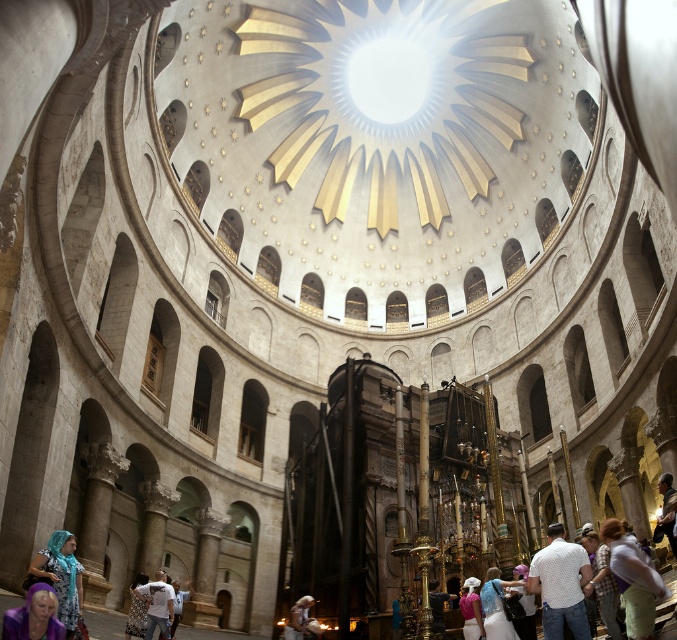
Question: Is the position of printed fabric headscarf at lower left less distant than that of pink fabric dress at center?

Choices:
 (A) yes
 (B) no

Answer: (A)

Question: Which object is closer to the camera taking this photo?

Choices:
 (A) pink fabric dress at center
 (B) blue satin dress at lower center
 (C) purple fabric at lower left

Answer: (C)

Question: Which object appears closest to the camera in this image?

Choices:
 (A) white cotton shirt at lower center
 (B) light brown leather jacket at lower center
 (C) blue satin dress at lower center
 (D) white fabric at center

Answer: (D)

Question: Does purple fabric at lower left lie in front of light brown leather jacket at lower center?

Choices:
 (A) yes
 (B) no

Answer: (A)

Question: Is blue satin dress at lower center positioned at the back of white cotton shirt at lower center?

Choices:
 (A) no
 (B) yes

Answer: (A)

Question: Estimate the real-world distances between objects in this image. Which object is closer to the white fabric at center?

Choices:
 (A) white cotton shirt at lower center
 (B) pink fabric dress at center
 (C) light brown leather jacket at lower center

Answer: (B)